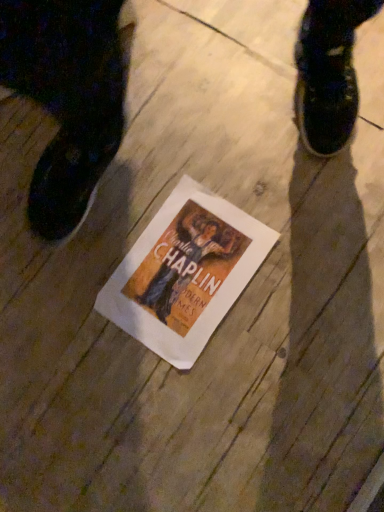
In order to face matte paper poster at center, should I rotate leftwards or rightwards?

Turn left by 0.736 degrees to look at matte paper poster at center.

What do you see at coordinates (185, 273) in the screenshot? I see `matte paper poster at center` at bounding box center [185, 273].

Find the location of a particular element. matte paper poster at center is located at coordinates (185, 273).

The image size is (384, 512). Find the location of `matte paper poster at center`. matte paper poster at center is located at coordinates (185, 273).